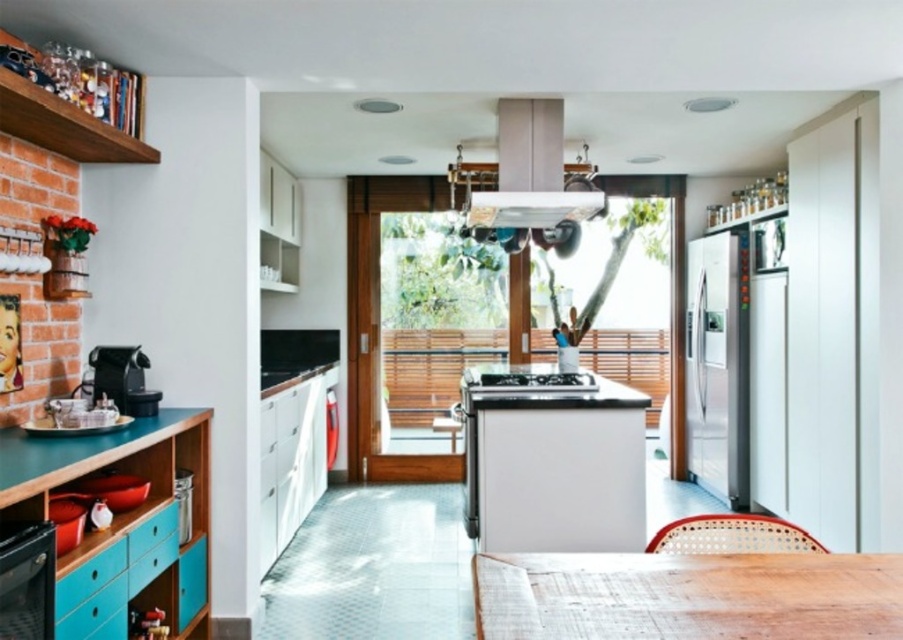
Which is above, wooden table at center or black glass oven at lower left?

Positioned higher is wooden table at center.

Where is `wooden table at center`? The image size is (903, 640). wooden table at center is located at coordinates (687, 596).

Does satin silver refrigerator at right appear over matte gray exhaust hood at upper center?

Actually, satin silver refrigerator at right is below matte gray exhaust hood at upper center.

Between satin silver refrigerator at right and matte gray exhaust hood at upper center, which one has more height?

Standing taller between the two is satin silver refrigerator at right.

The image size is (903, 640). I want to click on satin silver refrigerator at right, so click(x=717, y=364).

Find the location of a particular element. This screenshot has height=640, width=903. satin silver refrigerator at right is located at coordinates (717, 364).

Who is higher up, wooden table at center or satin silver refrigerator at right?

satin silver refrigerator at right is above.

Can you confirm if wooden table at center is positioned to the right of satin silver refrigerator at right?

In fact, wooden table at center is to the left of satin silver refrigerator at right.

Image resolution: width=903 pixels, height=640 pixels. What are the coordinates of `wooden table at center` in the screenshot? It's located at (687, 596).